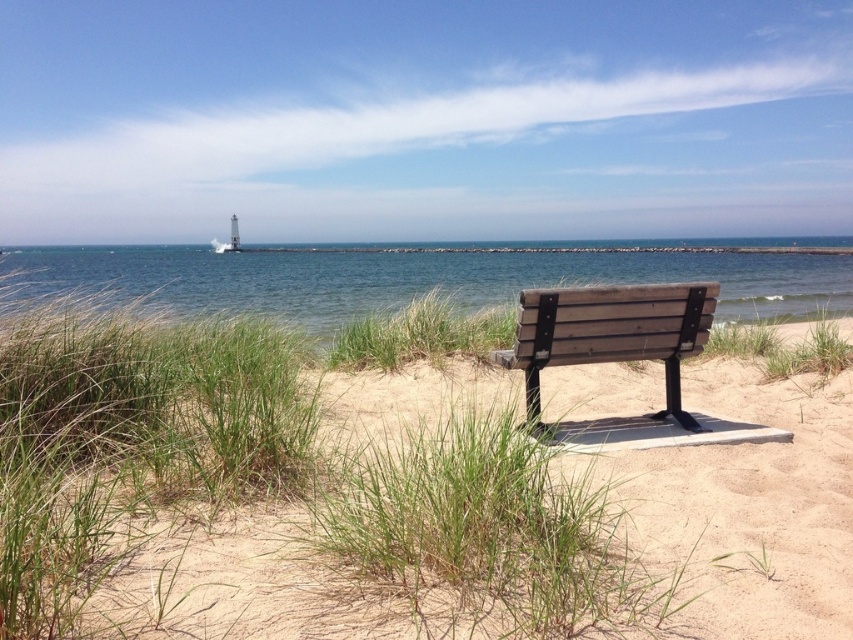
From the picture: You are standing on the beach and want to reach the clear blue water at center. According to the coordinates provided, in which direction should you walk from your current position to reach it?

The clear blue water at center is located at coordinates point (403, 280), so you should walk towards the center of the image to reach it.

You are planning to set up a picnic on the beach. The area has green grass at center and clear blue water at center. Which area would you choose if you want to maximize the space for your picnic blanket?

The clear blue water at center occupies more space than the green grass at center, so you should choose the clear blue water at center for a larger picnic area.